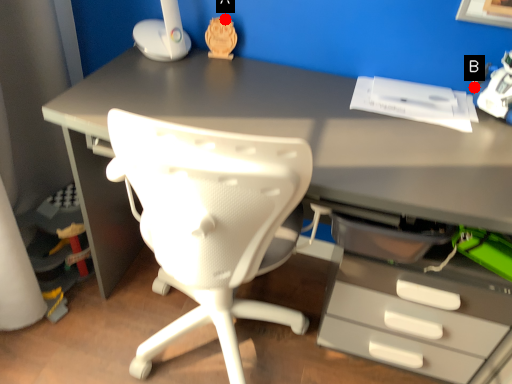
Question: Two points are circled on the image, labeled by A and B beside each circle. Which point is closer to the camera?

Choices:
 (A) A is closer
 (B) B is closer

Answer: (B)